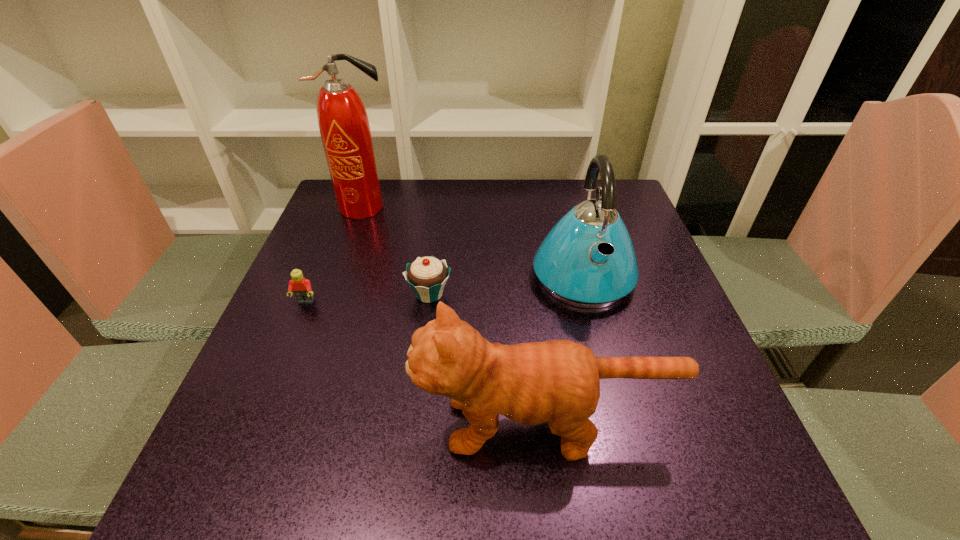
Where is `the tallest object`? This screenshot has height=540, width=960. the tallest object is located at coordinates (343, 122).

Where is `fire extinguisher`? The width and height of the screenshot is (960, 540). fire extinguisher is located at coordinates (343, 122).

Where is `kettle`? The width and height of the screenshot is (960, 540). kettle is located at coordinates (588, 260).

The width and height of the screenshot is (960, 540). Identify the location of cat. (557, 381).

You are a GUI agent. You are given a task and a screenshot of the screen. Output one action in this format:
    pyautogui.click(x=<x>, y=<y>)
    Task: Click on the cupcake
    The width and height of the screenshot is (960, 540).
    Given the screenshot: What is the action you would take?
    pyautogui.click(x=427, y=276)

Where is `the shortest object`? The width and height of the screenshot is (960, 540). the shortest object is located at coordinates (302, 289).

Identify the location of vacant area situated 0.290m on the right of the tallest object. (498, 207).

At what (x,y) coordinates should I click in order to perform the action: click on vacant area situated at the spout of the kettle. Please return your answer as a coordinate pair (x, y). Looking at the image, I should click on (612, 389).

You are a GUI agent. You are given a task and a screenshot of the screen. Output one action in this format:
    pyautogui.click(x=<x>, y=<y>)
    Task: Click on the vacant space located on the face of the cat
    Image resolution: width=960 pixels, height=540 pixels.
    Given the screenshot: What is the action you would take?
    pyautogui.click(x=292, y=424)

I want to click on free space located 0.250m on the face of the cat, so click(x=269, y=424).